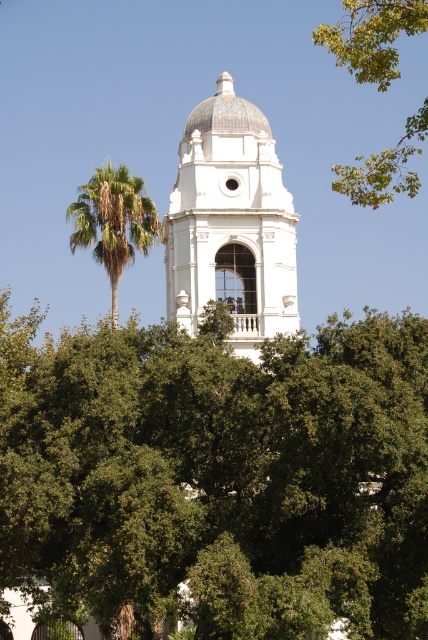
Looking at this image, who is shorter, green leafy palm at upper left or multicolored mosaic dome at center?

multicolored mosaic dome at center

Who is more distant from viewer, [98,195] or [214,108]?

The point [214,108] is more distant.

At what (x,y) coordinates should I click in order to perform the action: click on green leafy palm at upper left. Please return your answer as a coordinate pair (x, y). This screenshot has width=428, height=640. Looking at the image, I should click on (112, 221).

Does green leafy tree at center appear on the left side of green leafy tree at upper right?

Yes, green leafy tree at center is to the left of green leafy tree at upper right.

Is green leafy tree at center to the right of green leafy tree at upper right from the viewer's perspective?

In fact, green leafy tree at center is to the left of green leafy tree at upper right.

Between point (261, 420) and point (362, 8), which one is positioned behind?

The point (362, 8) is more distant.

Where is `green leafy tree at center`? The height and width of the screenshot is (640, 428). green leafy tree at center is located at coordinates (219, 474).

Can you confirm if green leafy tree at center is positioned to the left of white glossy dome at center?

Incorrect, green leafy tree at center is not on the left side of white glossy dome at center.

Who is more forward, (77, 600) or (249, 257)?

Positioned in front is point (77, 600).

The height and width of the screenshot is (640, 428). Find the location of `green leafy tree at center`. green leafy tree at center is located at coordinates (219, 474).